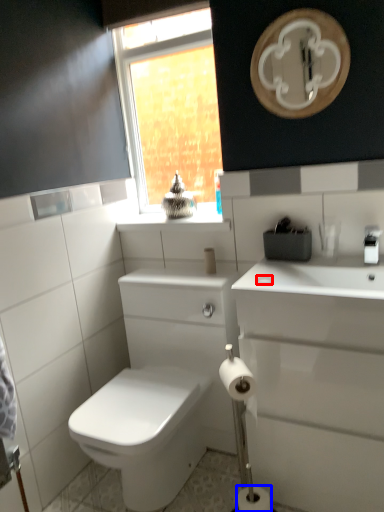
Question: Which object is further to the camera taking this photo, soap (highlighted by a red box) or toilet paper (highlighted by a blue box)?

Choices:
 (A) soap
 (B) toilet paper

Answer: (A)